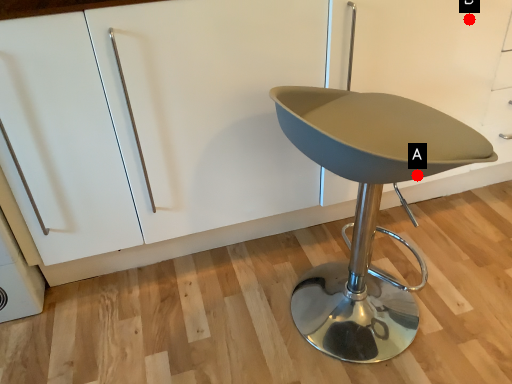
Question: Two points are circled on the image, labeled by A and B beside each circle. Which point is further to the camera?

Choices:
 (A) A is further
 (B) B is further

Answer: (B)